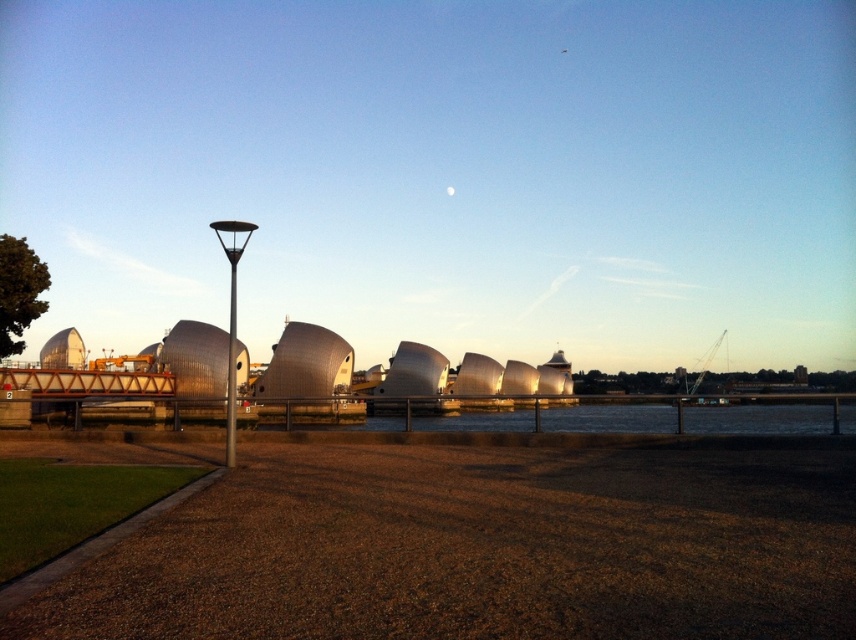
Question: Which of the following is the farthest from the observer?

Choices:
 (A) (227, 422)
 (B) (85, 547)

Answer: (A)

Question: Does green grass at lower left have a smaller size compared to silver metallic lamp post at left?

Choices:
 (A) yes
 (B) no

Answer: (A)

Question: Where is silver metallic lamp post at left located in relation to metallic pole at left in the image?

Choices:
 (A) below
 (B) above

Answer: (B)

Question: Which is farther from the metallic pole at left?

Choices:
 (A) silver metallic lamp post at left
 (B) green grass at lower left

Answer: (B)

Question: Which object is closer to the camera taking this photo?

Choices:
 (A) metallic pole at left
 (B) silver metallic lamp post at left
 (C) green grass at lower left

Answer: (C)

Question: From the image, what is the correct spatial relationship of green grass at lower left in relation to silver metallic lamp post at left?

Choices:
 (A) below
 (B) above

Answer: (A)